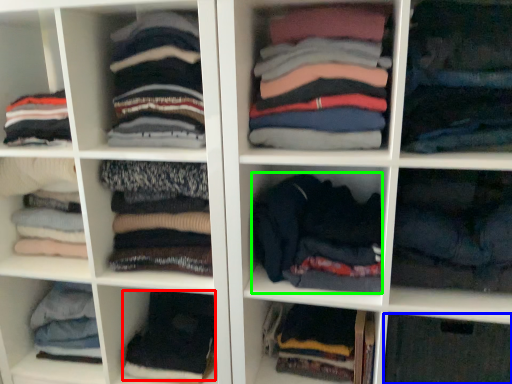
Question: Estimate the real-world distances between objects in this image. Which object is closer to clothing (highlighted by a red box), cabinet (highlighted by a blue box) or clothing (highlighted by a green box)?

Choices:
 (A) cabinet
 (B) clothing

Answer: (B)